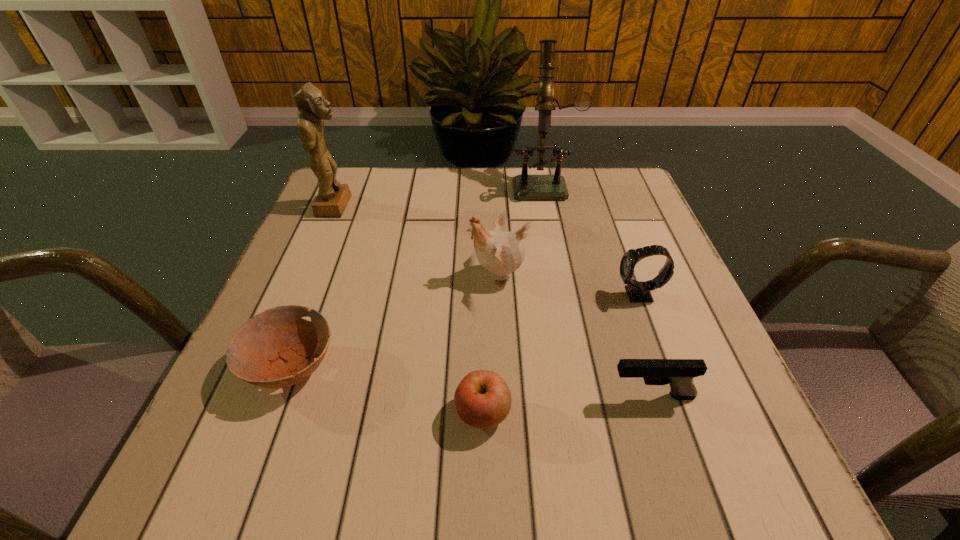
Find the location of a particular element. The width and height of the screenshot is (960, 540). blank space at the far edge of the desktop is located at coordinates (484, 193).

In the image, there is a desktop. At what (x,y) coordinates should I click in order to perform the action: click on free region at the left edge. Please return your answer as a coordinate pair (x, y). Image resolution: width=960 pixels, height=540 pixels. Looking at the image, I should click on (331, 243).

Locate an element on the screen. The width and height of the screenshot is (960, 540). vacant space at the right edge of the desktop is located at coordinates (719, 430).

The image size is (960, 540). In the image, there is a desktop. In order to click on free space at the far right corner in this screenshot , I will do `click(616, 178)`.

Where is `blank area at the near right corner`? This screenshot has height=540, width=960. blank area at the near right corner is located at coordinates (703, 490).

Identify the location of free space that is in between the apple and the microscope. Image resolution: width=960 pixels, height=540 pixels. (514, 298).

Where is `free space between the apple and the microscope`? The height and width of the screenshot is (540, 960). free space between the apple and the microscope is located at coordinates (514, 298).

Locate an element on the screen. The height and width of the screenshot is (540, 960). free space that is in between the fourth shortest object and the pistol is located at coordinates (645, 346).

Where is `free space between the watch and the apple`? The image size is (960, 540). free space between the watch and the apple is located at coordinates (561, 354).

Identify the location of empty location between the bird and the pistol. (574, 335).